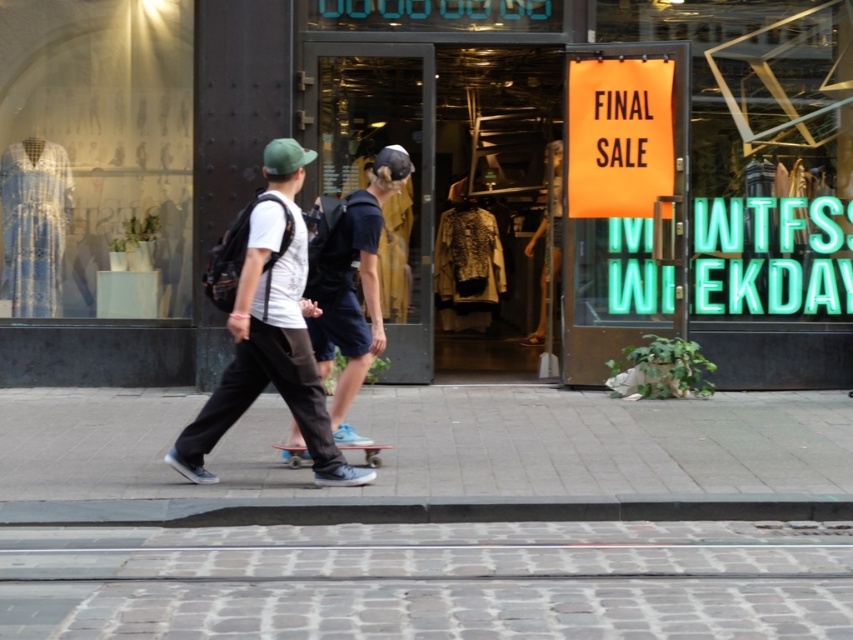
Who is lower down, dark gray pants at center or matte black skateboard at center?

dark gray pants at center is below.

Looking at this image, can you confirm if dark gray pants at center is taller than matte black skateboard at center?

Yes.

You are a GUI agent. You are given a task and a screenshot of the screen. Output one action in this format:
    pyautogui.click(x=<x>, y=<y>)
    Task: Click on the dark gray pants at center
    The height and width of the screenshot is (640, 853).
    Given the screenshot: What is the action you would take?
    pyautogui.click(x=265, y=324)

Who is more distant from viewer, (651, 576) or (343, 248)?

Point (343, 248)

Locate an element on the screen. white textured pavement at lower center is located at coordinates (431, 580).

In the scene shown: Is matte black sign at center shorter than matte glass dress at left?

Yes.

Can you confirm if matte black sign at center is positioned below matte glass dress at left?

No, matte black sign at center is not below matte glass dress at left.

You are a GUI agent. You are given a task and a screenshot of the screen. Output one action in this format:
    pyautogui.click(x=<x>, y=<y>)
    Task: Click on the matte black sign at center
    
    Given the screenshot: What is the action you would take?
    pyautogui.click(x=430, y=179)

Where is `matte black sign at center`? Image resolution: width=853 pixels, height=640 pixels. matte black sign at center is located at coordinates (430, 179).